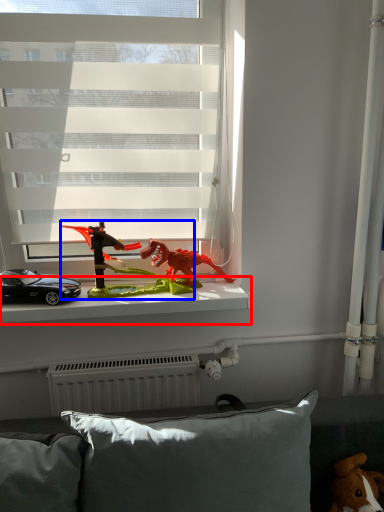
Question: Which point is further to the camera, window sill (highlighted by a red box) or toy (highlighted by a blue box)?

Choices:
 (A) window sill
 (B) toy

Answer: (A)